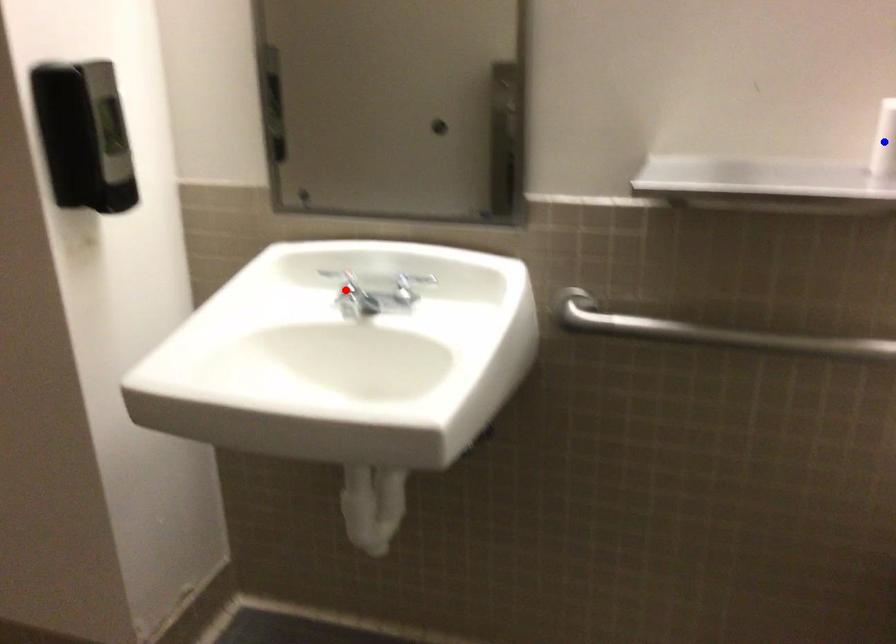
Question: Two points are marked on the image. Which point is closer to the camera?

Choices:
 (A) Blue point is closer.
 (B) Red point is closer.

Answer: (A)